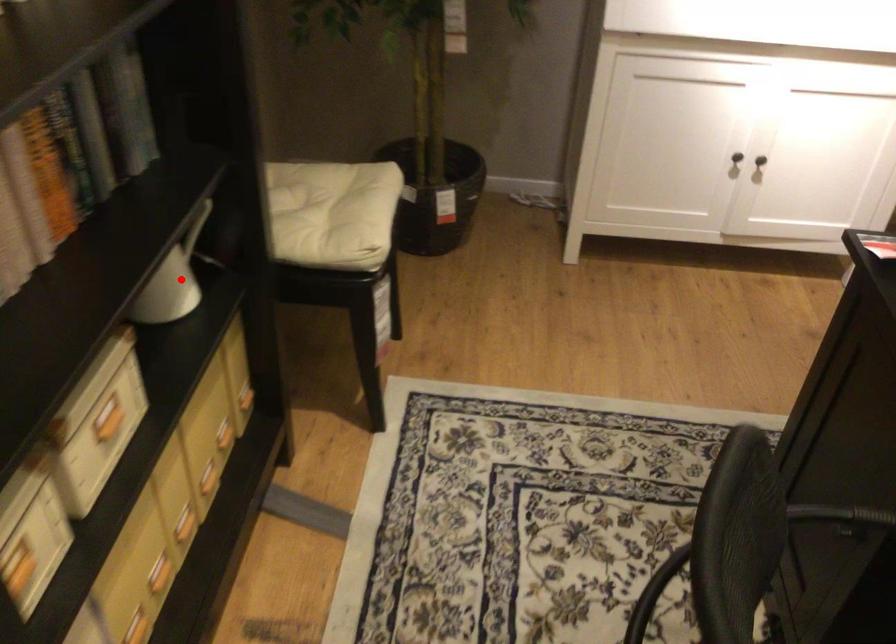
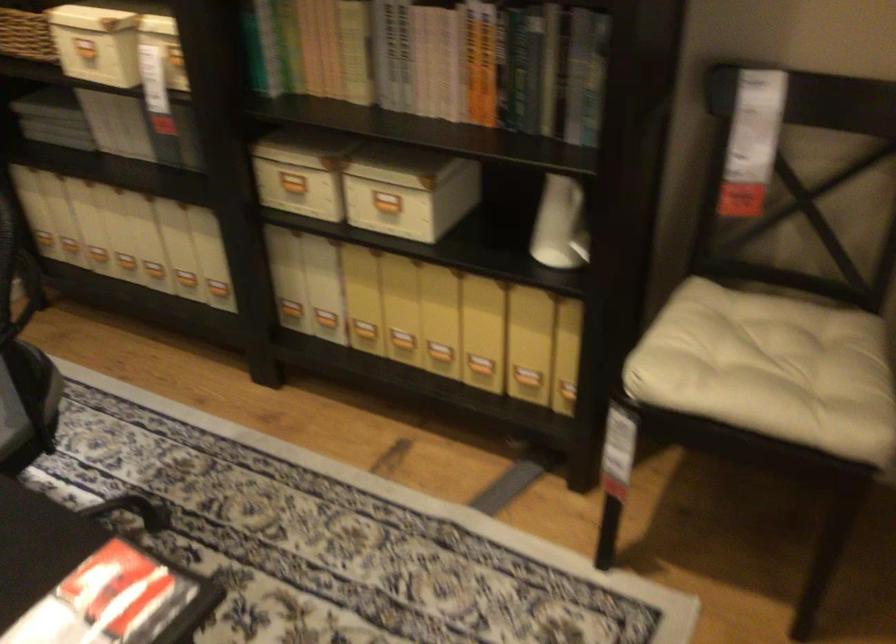
Question: I am providing you with two images of the same scene from different viewpoints. In image1, a red point is highlighted. Considering the same 3D point in image2, which of the following is correct?

Choices:
 (A) It is closer
 (B) It is farther

Answer: (B)